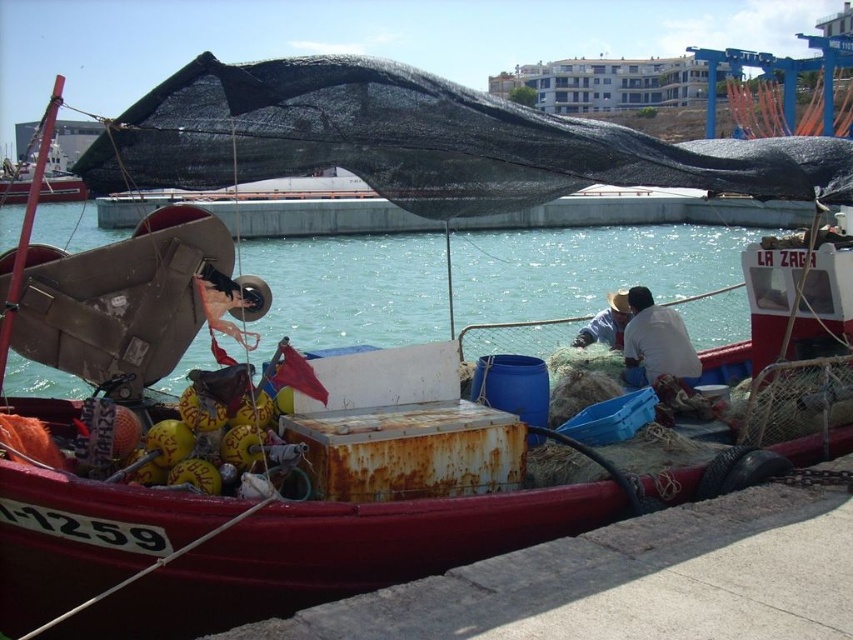
You are standing on the dock and see two white items on the boat deck. The white matte shirt at center and the white straw hat at center. Which one is closer to you?

The white matte shirt at center is closer to the viewer than the white straw hat at center.

You are a photographer planning to take a photo of the clear blue water at center and the white straw hat at center from the dock. Which object will appear wider in the photo?

The clear blue water at center will appear wider in the photo because its width surpasses that of the white straw hat at center.

You are standing on the dock next to the fishing boat. If you look straight ahead towards the boat, where would you see the clear blue water at center?

The clear blue water at center is located at point [587,268], which would be directly in front of you when looking straight ahead towards the boat.